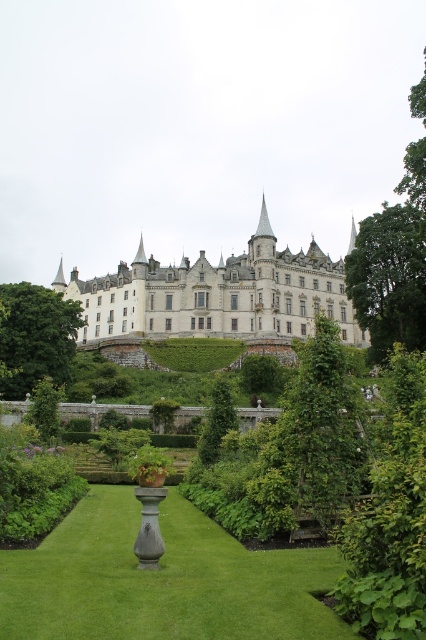
Question: Does white stone castle at center lie in front of green leafy hedge at lower left?

Choices:
 (A) yes
 (B) no

Answer: (B)

Question: Which object is farther from the camera taking this photo?

Choices:
 (A) green leafy hedge at lower left
 (B) green leafy hedge at center

Answer: (B)

Question: Which is nearer to the white stone castle at center?

Choices:
 (A) green grass at center
 (B) green leafy hedge at center

Answer: (B)

Question: Estimate the real-world distances between objects in this image. Which object is farther from the green leafy hedge at right?

Choices:
 (A) white stone castle at center
 (B) green grass at center
 (C) green leafy hedge at lower left
 (D) green leafy hedge at center

Answer: (A)

Question: Can you confirm if white stone castle at center is thinner than green leafy hedge at lower left?

Choices:
 (A) no
 (B) yes

Answer: (A)

Question: Where is green grass at center located in relation to green leafy hedge at lower left in the image?

Choices:
 (A) left
 (B) right

Answer: (B)